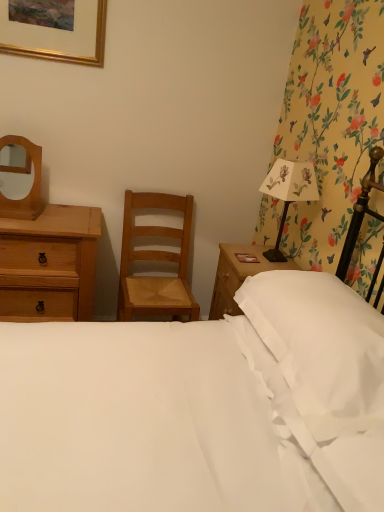
Question: From the image's perspective, is white paper lampshade at right located above or below matte wooden mirror at upper left?

Choices:
 (A) above
 (B) below

Answer: (B)

Question: Is white paper lampshade at right to the left or to the right of matte wooden mirror at upper left in the image?

Choices:
 (A) right
 (B) left

Answer: (A)

Question: Which is nearer to the gold metallic picture frame at upper left?

Choices:
 (A) white paper lampshade at right
 (B) white smooth bed at center
 (C) light brown wood chair at center
 (D) matte wooden mirror at upper left
 (E) white soft pillow at right

Answer: (D)

Question: Based on their relative distances, which object is farther from the white soft pillow at right?

Choices:
 (A) light brown wood chair at center
 (B) white paper lampshade at right
 (C) gold metallic picture frame at upper left
 (D) natural wood chest of drawers at left
 (E) white smooth bed at center

Answer: (C)